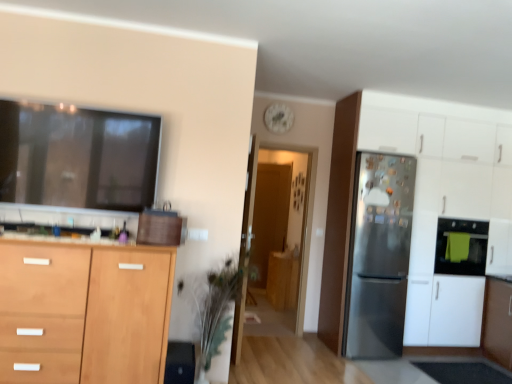
Question: Is white matte clock at upper center oriented away from satin silver refrigerator at right, which is the 3th cabinetry in left-to-right order?

Choices:
 (A) yes
 (B) no

Answer: (B)

Question: From the image's perspective, is white matte clock at upper center on satin silver refrigerator at right, the first cabinetry positioned from the right?

Choices:
 (A) yes
 (B) no

Answer: (A)

Question: Considering the relative sizes of white matte clock at upper center and satin silver refrigerator at right, positioned as the second cabinetry in back-to-front order, in the image provided, is white matte clock at upper center thinner than satin silver refrigerator at right, positioned as the second cabinetry in back-to-front order,?

Choices:
 (A) yes
 (B) no

Answer: (A)

Question: Is the depth of white matte clock at upper center greater than that of satin silver refrigerator at right, the 2th cabinetry when ordered from front to back?

Choices:
 (A) yes
 (B) no

Answer: (A)

Question: Considering the relative sizes of white matte clock at upper center and satin silver refrigerator at right, the first cabinetry positioned from the right, in the image provided, is white matte clock at upper center smaller than satin silver refrigerator at right, the first cabinetry positioned from the right,?

Choices:
 (A) yes
 (B) no

Answer: (A)

Question: From a real-world perspective, is white matte clock at upper center over satin silver refrigerator at right, the first cabinetry positioned from the right?

Choices:
 (A) yes
 (B) no

Answer: (A)

Question: From the image's perspective, is green leafy plant at center above white matte clock at upper center?

Choices:
 (A) no
 (B) yes

Answer: (A)

Question: Does green leafy plant at center have a greater height compared to white matte clock at upper center?

Choices:
 (A) yes
 (B) no

Answer: (A)

Question: Is green leafy plant at center not close to white matte clock at upper center?

Choices:
 (A) no
 (B) yes

Answer: (B)

Question: Can you confirm if green leafy plant at center is smaller than white matte clock at upper center?

Choices:
 (A) yes
 (B) no

Answer: (B)

Question: Does green leafy plant at center lie behind white matte clock at upper center?

Choices:
 (A) no
 (B) yes

Answer: (A)

Question: Is the position of green leafy plant at center less distant than that of white matte clock at upper center?

Choices:
 (A) yes
 (B) no

Answer: (A)

Question: Can you confirm if green towel oven at right is shorter than satin silver refrigerator at right?

Choices:
 (A) yes
 (B) no

Answer: (A)